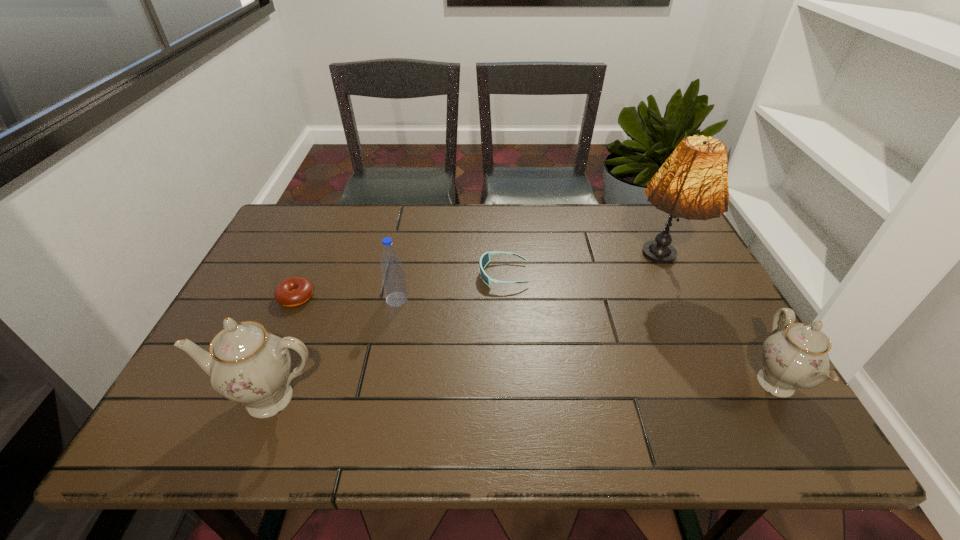
I want to click on free spot located 0.110m on the back of the fourth object from right to left, so 404,265.

Identify the location of free space located on the front-facing side of the lampshade. This screenshot has width=960, height=540. (702, 364).

At what (x,y) coordinates should I click in order to perform the action: click on vacant point located 0.380m on the right of the doughnut. Please return your answer as a coordinate pair (x, y). This screenshot has width=960, height=540. Looking at the image, I should click on [458, 298].

Where is `object positioned at the far edge`? The width and height of the screenshot is (960, 540). object positioned at the far edge is located at coordinates (692, 183).

The width and height of the screenshot is (960, 540). I want to click on chinaware present at the left edge, so click(246, 364).

Identify the location of doughnut that is at the left edge. The height and width of the screenshot is (540, 960). (294, 291).

You are a GUI agent. You are given a task and a screenshot of the screen. Output one action in this format:
    pyautogui.click(x=<x>, y=<y>)
    Task: Click on the chinaware present at the right edge
    The image size is (960, 540).
    Given the screenshot: What is the action you would take?
    pyautogui.click(x=797, y=356)

Where is `lampshade that is at the right edge`? The image size is (960, 540). lampshade that is at the right edge is located at coordinates (692, 183).

Identify the location of object that is at the near left corner. (246, 364).

You are a GUI agent. You are given a task and a screenshot of the screen. Output one action in this format:
    pyautogui.click(x=<x>, y=<y>)
    Task: Click on the object located at the far right corner
    Image resolution: width=960 pixels, height=540 pixels.
    Given the screenshot: What is the action you would take?
    pyautogui.click(x=692, y=183)